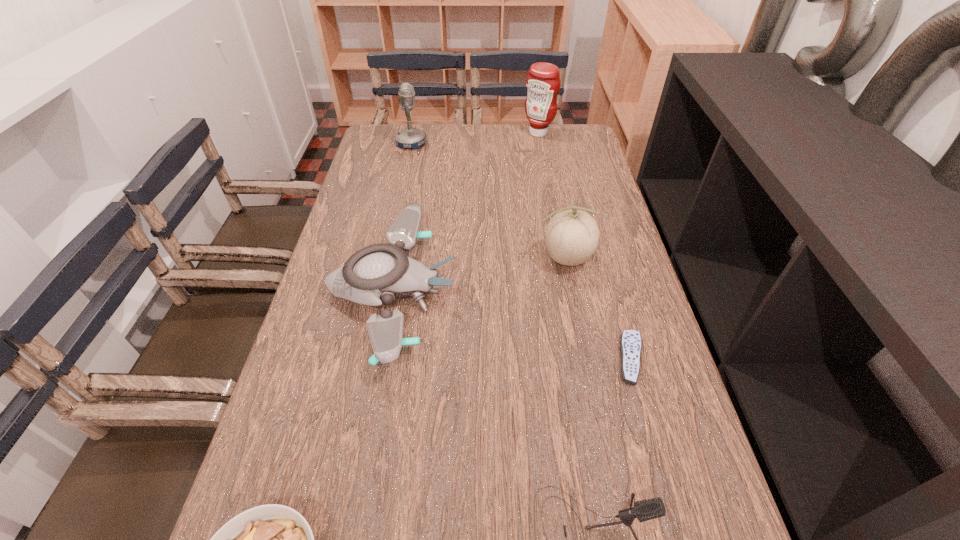
Where is `condiment`? This screenshot has width=960, height=540. condiment is located at coordinates [x=543, y=83].

Identify the location of the taller microphone. The height and width of the screenshot is (540, 960). (408, 138).

Identify the location of the farther microphone. The width and height of the screenshot is (960, 540). (408, 138).

Find the location of `cantaloup`. cantaloup is located at coordinates (571, 237).

At what (x,y) coordinates should I click in order to perform the action: click on drone. Please return your answer as a coordinate pair (x, y). The image size is (960, 540). Looking at the image, I should click on (374, 275).

This screenshot has height=540, width=960. I want to click on remote control, so click(630, 343).

Find the location of `free point located on the right of the condiment`. free point located on the right of the condiment is located at coordinates [572, 133].

Find the location of `vacant space situated on the front-facing side of the farther microphone`. vacant space situated on the front-facing side of the farther microphone is located at coordinates (522, 143).

I want to click on vacant space positioned 0.100m on the left of the cantaloup, so click(501, 259).

Image resolution: width=960 pixels, height=540 pixels. I want to click on free point located 0.310m on the front-facing side of the drone, so click(x=578, y=292).